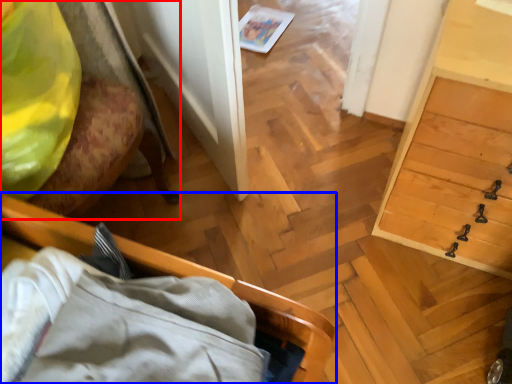
Question: Which point is closer to the camera, furniture (highlighted by a red box) or furniture (highlighted by a blue box)?

Choices:
 (A) furniture
 (B) furniture

Answer: (B)